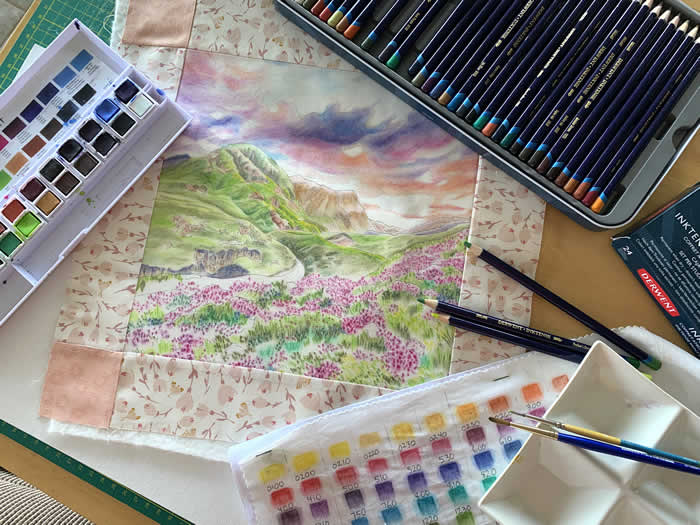
In order to click on divided square container in this screenshot , I will do [507, 475].